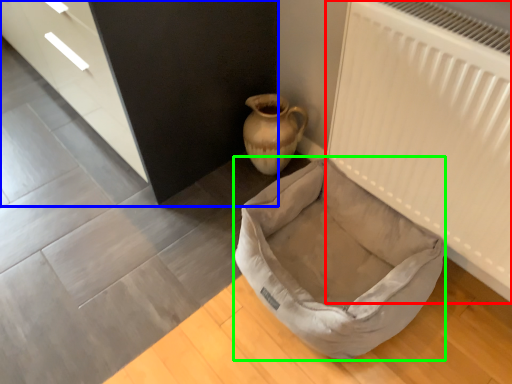
Question: Which object is positioned farthest from radiator (highlighted by a red box)? Select from dresser (highlighted by a blue box) and dog bed (highlighted by a green box).

Choices:
 (A) dresser
 (B) dog bed

Answer: (A)